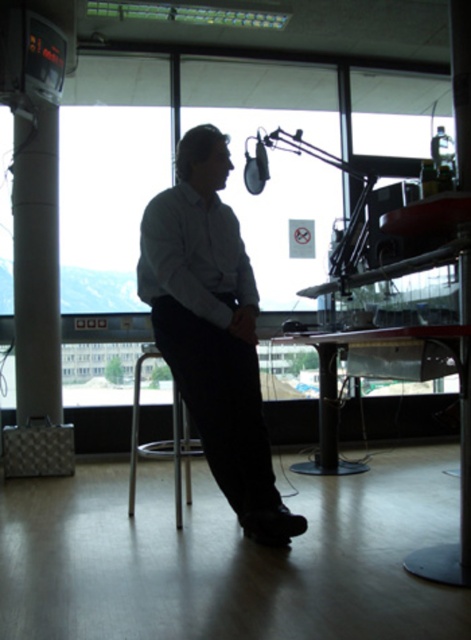
Looking at this image, who is more distant from viewer, (57, 227) or (463, 529)?

The point (57, 227) is more distant.

Who is taller, white glossy pillar at left or matte black pillar at center?

With more height is white glossy pillar at left.

Does point (17, 291) come in front of point (459, 13)?

No, (17, 291) is behind (459, 13).

Where is `white glossy pillar at left`? The width and height of the screenshot is (471, 640). white glossy pillar at left is located at coordinates (37, 268).

Can you confirm if white matte dress shirt at center is bigger than transparent glass table at center?

No, white matte dress shirt at center is not bigger than transparent glass table at center.

Measure the distance between point [186,184] and camera.

Point [186,184] and camera are 8.40 feet apart.

You are a GUI agent. You are given a task and a screenshot of the screen. Output one action in this format:
    pyautogui.click(x=<x>, y=<y>)
    Task: Click on the white matte dress shirt at center
    
    Given the screenshot: What is the action you would take?
    pyautogui.click(x=194, y=256)

Locate an element on the screen. white matte dress shirt at center is located at coordinates (194, 256).

Is point (138, 262) closer to viewer compared to point (181, 433)?

Yes, point (138, 262) is closer to viewer.

Between point (193, 355) and point (129, 467), which one is positioned behind?

The point (129, 467) is behind.

Between point (160, 260) and point (186, 452), which one is positioned behind?

The point (186, 452) is more distant.

I want to click on light gray shirt at center, so click(x=212, y=330).